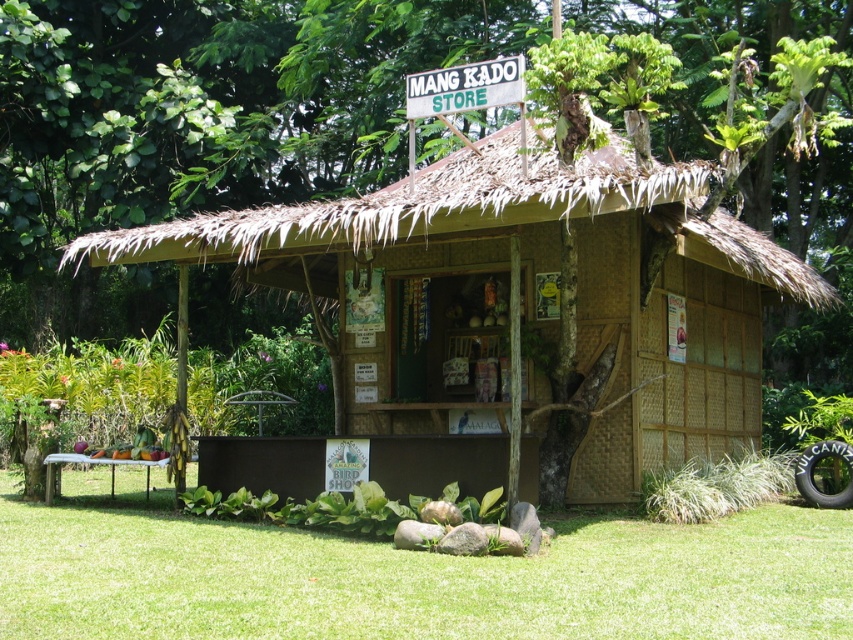
You are standing in front of the store and want to locate two specific points marked on the store structure. The first point is at coordinate point [289,257] and the second is at point [521,83]. Which point is closer to you?

Point [289,257] is closer to you because it is further to the viewer than point [521,83].

You are standing in front of the MANG KADO STORE and want to walk towards the green grass at lower center. Which direction should you face relative to the bamboo hut at center?

The bamboo hut at center is to the right of green grass at lower center, so you should face to the left of the bamboo hut at center to walk towards the green grass at lower center.